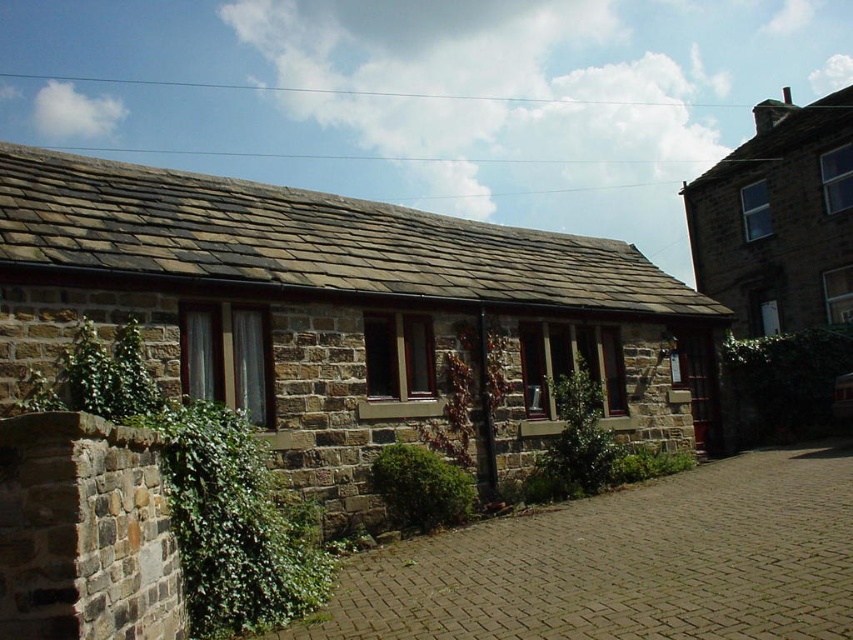
You are standing at the entrance of the brown stone cottage at upper right and looking towards the green leafy ivy at left. Which object is taller when viewed from this perspective?

The brown stone cottage at upper right is taller than the green leafy ivy at left.

Looking at this image, you are a gardener planning to trim the green leafy ivy at left and the brown stone cottage at upper right. Which of the two plants requires more attention to avoid overgrowth?

The brown stone cottage at upper right requires more attention because it is thicker than the green leafy ivy at left, making it more prone to overgrowth.